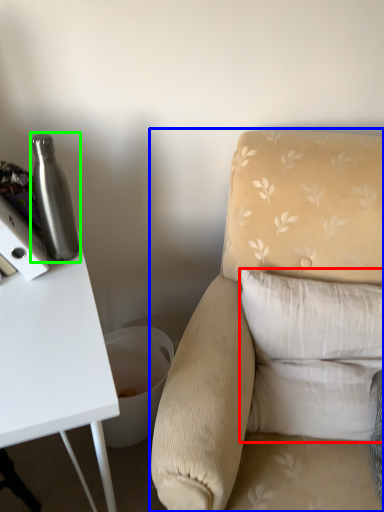
Question: Which is farther away from pillow (highlighted by a red box)? chair (highlighted by a blue box) or bottle (highlighted by a green box)?

Choices:
 (A) chair
 (B) bottle

Answer: (B)